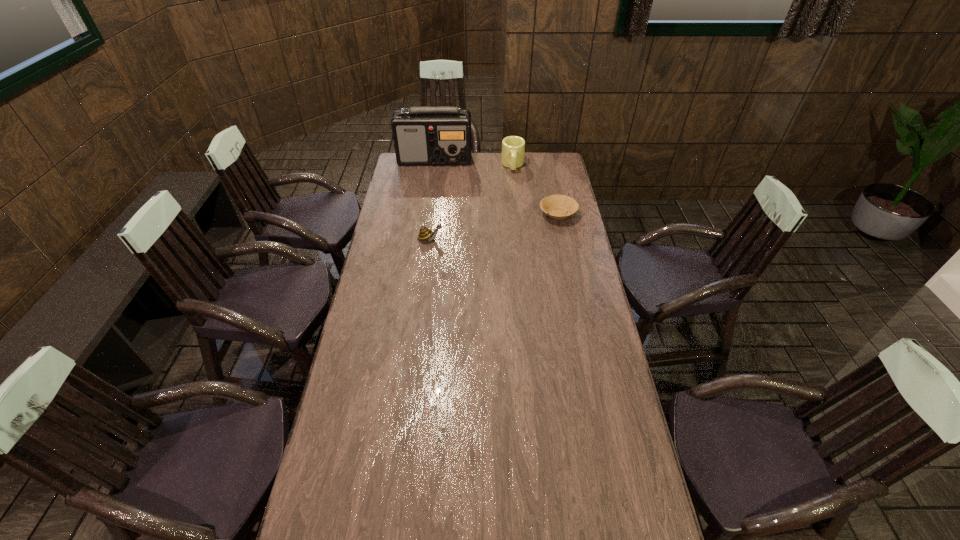
This screenshot has width=960, height=540. I want to click on free point located 0.180m on the front panel of the tallest object, so click(x=468, y=183).

This screenshot has width=960, height=540. In order to click on vacant space located 0.230m on the front panel of the tallest object in this screenshot , I will do `click(473, 187)`.

Identify the location of vacant space situated 0.050m on the front panel of the tallest object. (457, 171).

You are a GUI agent. You are given a task and a screenshot of the screen. Output one action in this format:
    pyautogui.click(x=<x>, y=<y>)
    Task: Click on the mug located at the far edge
    This screenshot has height=540, width=960.
    Given the screenshot: What is the action you would take?
    pyautogui.click(x=513, y=147)

I want to click on radio receiver that is positioned at the far edge, so click(427, 135).

At what (x,y) coordinates should I click in order to perform the action: click on object that is positioned at the left edge. Please return your answer as a coordinate pair (x, y). Looking at the image, I should click on (427, 135).

Find the location of a particular element. object located at the right edge is located at coordinates (559, 207).

You are a GUI agent. You are given a task and a screenshot of the screen. Output one action in this format:
    pyautogui.click(x=<x>, y=<y>)
    Task: Click on the object that is at the far left corner
    
    Given the screenshot: What is the action you would take?
    pyautogui.click(x=427, y=135)

Where is `vacant space at the far edge of the desktop`? The width and height of the screenshot is (960, 540). vacant space at the far edge of the desktop is located at coordinates (530, 166).

The image size is (960, 540). In the image, there is a desktop. Identify the location of vacant area at the left edge. (x=395, y=265).